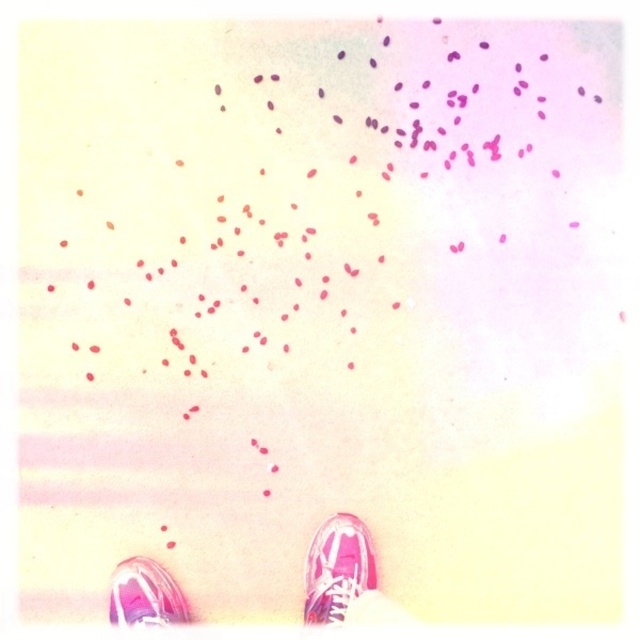
You are standing on the ground covered with light colored sand and small pink and red dots. You see two pink canvas shoes at lower center and a pink canvas shoe at lower right. Which one is wider?

The pink canvas shoes at lower center might be wider than pink canvas shoe at lower right.

You are standing in the scene and want to place a small object exactly halfway between point (352, 608) and point (333, 621). Which point is closer to you, and will the midpoint be closer to the viewer or farther away?

Point (352, 608) is closer to you. The midpoint between the two points will be closer to the viewer than point (333, 621) but farther than point (352, 608).

You are standing in the image and want to place a small object exactly at the point marked as point (337, 568). Which object in the scene is located at that coordinate?

The pink canvas shoe at lower right is located at point (337, 568).